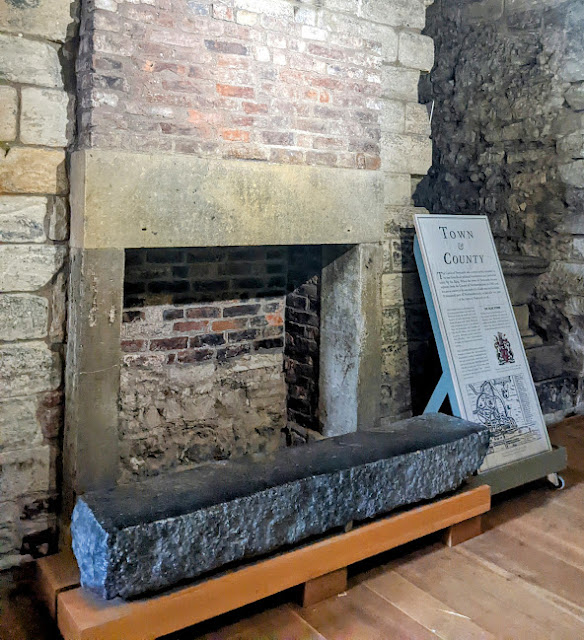
Identify the location of right side of fireplace. This screenshot has width=584, height=640. (93, 369).